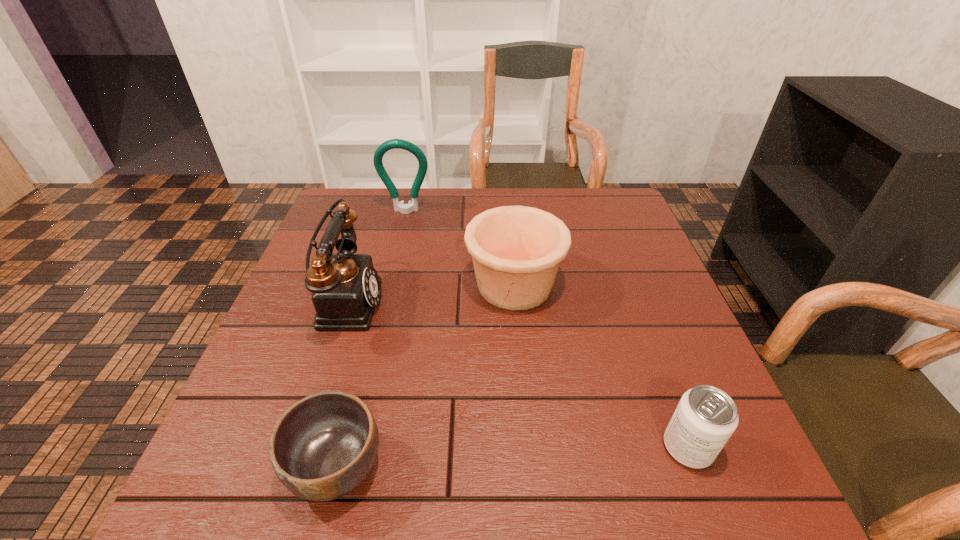
Find the location of a particular element. Image resolution: width=960 pixels, height=540 pixels. object at the near left corner is located at coordinates tap(323, 446).

This screenshot has height=540, width=960. Identify the location of object that is at the near right corner. (705, 418).

The width and height of the screenshot is (960, 540). What are the coordinates of `blank space at the far edge of the desktop` in the screenshot? It's located at (397, 230).

Find the location of `vacant space at the near edge of the desktop`. vacant space at the near edge of the desktop is located at coordinates (504, 482).

The height and width of the screenshot is (540, 960). I want to click on free region at the left edge of the desktop, so click(x=244, y=399).

At what (x,y) coordinates should I click in order to perform the action: click on free region at the near left corner. Please return your answer as a coordinate pair (x, y). This screenshot has width=960, height=540. Looking at the image, I should click on (226, 474).

Locate an element on the screen. The height and width of the screenshot is (540, 960). vacant space at the far right corner of the desktop is located at coordinates (584, 202).

I want to click on vacant point located between the telephone and the farthest object, so click(375, 256).

Image resolution: width=960 pixels, height=540 pixels. What are the coordinates of `free space that is in between the fourth tallest object and the telephone` in the screenshot? It's located at (516, 374).

Locate an element on the screen. free spot between the third tallest object and the farthest object is located at coordinates (460, 248).